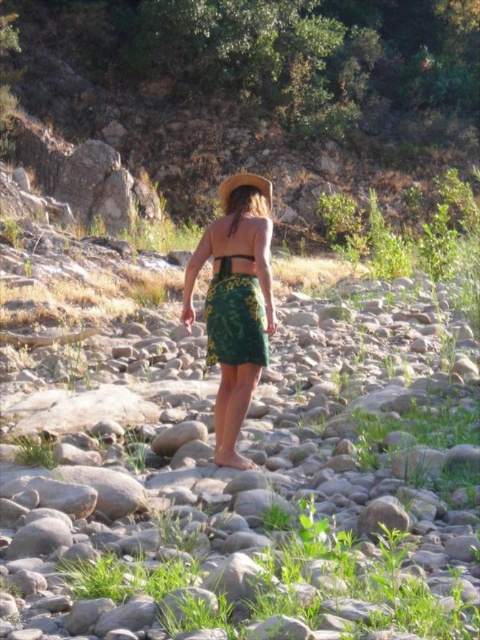
You are a fashion designer observing the outfit of the person in the image. The person is wearing a green floral skirt at center and a green fabric bikini top at back. Which part of their outfit is larger?

The green floral skirt at center is larger than the green fabric bikini top at back.

You are a fashion designer observing the image of a person in a green floral skirt at center and a green fabric bikini top at back. You need to create a new outfit that connects these two items. Can the outfit be designed so that the two pieces are 15 inches apart?

The distance between the green floral skirt at center and the green fabric bikini top at back is 15.47 inches. Since 15.47 inches is greater than 15 inches, the outfit can be designed to have the two pieces 15 inches apart.

You are a photographer planning to take a portrait of the person in the scene. You want to ensure that both the green floral skirt at center and the green fabric bikini top at back are clearly visible in the frame. Considering their positions, which one might appear larger in the photo?

The green floral skirt at center appears larger in the photo because it is taller than the green fabric bikini top at back.